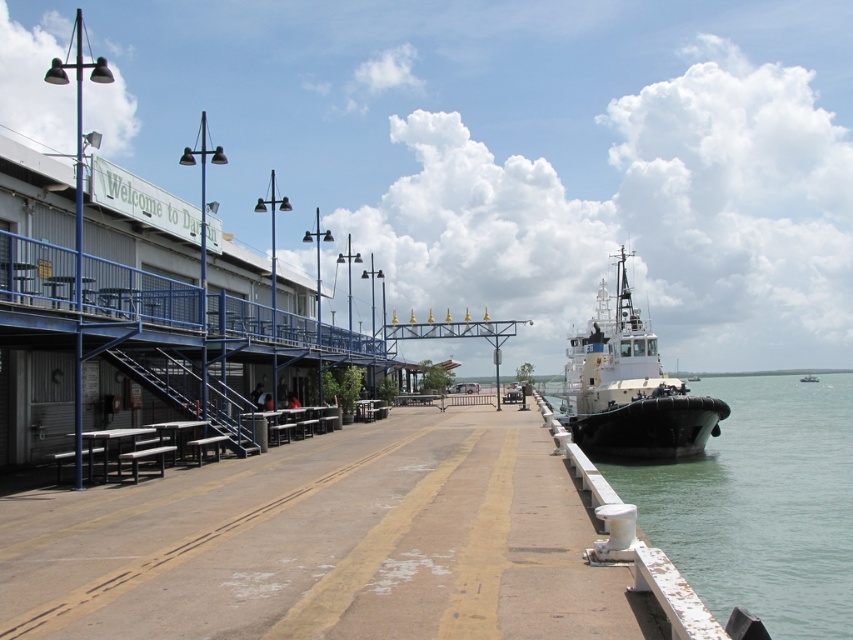
You are a tour guide leading a group to the Welcome to Darwin structure. You need to cross the walkway to reach it. Is there any obstruction between the greenish water at lower right and the white matte tugboat at right that might block your path?

The greenish water at lower right is positioned under the white matte tugboat at right, so the tugboat is over the water. Therefore, there is no obstruction blocking the path between them, and you can safely cross the walkway.

You are standing on the walkway in the waterfront scene. You see the brown concrete dock at center and the greenish water at lower right. Which object is positioned to the left of the other?

The brown concrete dock at center is to the left of greenish water at lower right.

You are a delivery person carrying a heavy box and need to cross the brown concrete dock at center and the greenish water at lower right. Which one is lower to the ground so you can easily step onto it?

The brown concrete dock at center has a lesser height compared to greenish water at lower right, so it is lower to the ground and easier to step onto.